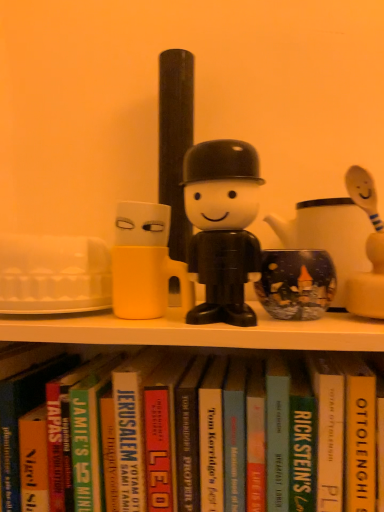
What do you see at coordinates (129, 435) in the screenshot? The image size is (384, 512). I see `hardcover book at center, the 1th paperback book positioned from the left` at bounding box center [129, 435].

Describe the element at coordinates (222, 227) in the screenshot. I see `black plastic figure at center` at that location.

In order to click on hardcover book at center, arranged as the second paperback book when viewed from the left in this screenshot , I will do `click(162, 432)`.

The width and height of the screenshot is (384, 512). Find the location of `hardcover book at center, which is counted as the fourth paperback book, starting from the right`. hardcover book at center, which is counted as the fourth paperback book, starting from the right is located at coordinates (188, 436).

Find the location of `hardcover book at center, marked as the fourth paperback book in a left-to-right arrangement`. hardcover book at center, marked as the fourth paperback book in a left-to-right arrangement is located at coordinates (277, 434).

Would you say hardcover book at center, the 1th paperback book positioned from the left, is to the left or to the right of hardcover book at center, the fifth paperback book when ordered from right to left, in the picture?

Based on their positions, hardcover book at center, the 1th paperback book positioned from the left, is located to the left of hardcover book at center, the fifth paperback book when ordered from right to left.

Considering the relative sizes of hardcover book at center, which is counted as the 6th paperback book, starting from the right, and hardcover book at center, the fifth paperback book when ordered from right to left, in the image provided, is hardcover book at center, which is counted as the 6th paperback book, starting from the right, thinner than hardcover book at center, the fifth paperback book when ordered from right to left,?

Correct, the width of hardcover book at center, which is counted as the 6th paperback book, starting from the right, is less than that of hardcover book at center, the fifth paperback book when ordered from right to left.

Which is nearer, (x=139, y=360) or (x=171, y=397)?

Point (x=139, y=360) is positioned farther from the camera compared to point (x=171, y=397).

The height and width of the screenshot is (512, 384). In order to click on toy on the left of the hardcover book at center, placed as the third paperback book when sorted from right to left in this screenshot , I will do `click(222, 227)`.

Considering the sizes of objects black plastic figure at center and hardcover book at center, placed as the third paperback book when sorted from right to left, in the image provided, who is wider, black plastic figure at center or hardcover book at center, placed as the third paperback book when sorted from right to left,?

With larger width is hardcover book at center, placed as the third paperback book when sorted from right to left.

Do you think black plastic figure at center is within hardcover book at center, marked as the fourth paperback book in a left-to-right arrangement, or outside of it?

black plastic figure at center is outside hardcover book at center, marked as the fourth paperback book in a left-to-right arrangement.

In the scene shown: Considering the relative positions of hardcover book at center, positioned as the third paperback book in left-to-right order, and black plastic figure at center in the image provided, is hardcover book at center, positioned as the third paperback book in left-to-right order, in front of black plastic figure at center?

No, hardcover book at center, positioned as the third paperback book in left-to-right order, is behind black plastic figure at center.

From the image's perspective, is hardcover book at center, positioned as the third paperback book in left-to-right order, over black plastic figure at center?

No.

Is hardcover book at center, positioned as the third paperback book in left-to-right order, shorter than black plastic figure at center?

In fact, hardcover book at center, positioned as the third paperback book in left-to-right order, may be taller than black plastic figure at center.

Is hardcover book at center, positioned as the third paperback book in left-to-right order, not near black plastic figure at center?

No.

At what (x,y) coordinates should I click in order to perform the action: click on the 4th paperback book behind the hardcover book at center, marked as the fourth paperback book in a left-to-right arrangement, counting from the anchor's position. Please return your answer as a coordinate pair (x, y). Looking at the image, I should click on (129, 435).

Looking at their sizes, would you say hardcover book at center, the 1th paperback book positioned from the left, is wider or thinner than hardcover book at center, marked as the fourth paperback book in a left-to-right arrangement?

hardcover book at center, the 1th paperback book positioned from the left, is thinner than hardcover book at center, marked as the fourth paperback book in a left-to-right arrangement.

Between hardcover book at center, the 1th paperback book positioned from the left, and hardcover book at center, placed as the third paperback book when sorted from right to left, which one appears on the left side from the viewer's perspective?

hardcover book at center, the 1th paperback book positioned from the left.

From a real-world perspective, is hardcover book at center, which is counted as the 6th paperback book, starting from the right, positioned over hardcover book at center, marked as the fourth paperback book in a left-to-right arrangement, based on gravity?

No, from a real-world perspective, hardcover book at center, which is counted as the 6th paperback book, starting from the right, is not above hardcover book at center, marked as the fourth paperback book in a left-to-right arrangement.

Is point (308, 443) closer to viewer compared to point (227, 317)?

No, (308, 443) is behind (227, 317).

Is green matte paperback book at center, marked as the fifth paperback book in a left-to-right arrangement, to the left or to the right of black plastic figure at center in the image?

In the image, green matte paperback book at center, marked as the fifth paperback book in a left-to-right arrangement, appears on the right side of black plastic figure at center.

From the image's perspective, is green matte paperback book at center, which is the 2th paperback book from right to left, located above or below black plastic figure at center?

From the image's perspective, green matte paperback book at center, which is the 2th paperback book from right to left, appears below black plastic figure at center.

Which object is further away from the camera, green matte paperback book at center, which is the 2th paperback book from right to left, or black plastic figure at center?

green matte paperback book at center, which is the 2th paperback book from right to left.

From a real-world perspective, is hardcover book at center, the fifth paperback book when ordered from right to left, located higher than green matte paperback book at center, marked as the fifth paperback book in a left-to-right arrangement?

No, from a real-world perspective, hardcover book at center, the fifth paperback book when ordered from right to left, is not above green matte paperback book at center, marked as the fifth paperback book in a left-to-right arrangement.

Looking at their sizes, would you say hardcover book at center, arranged as the second paperback book when viewed from the left, is wider or thinner than green matte paperback book at center, which is the 2th paperback book from right to left?

Clearly, hardcover book at center, arranged as the second paperback book when viewed from the left, has more width compared to green matte paperback book at center, which is the 2th paperback book from right to left.

Which object is positioned more to the right, hardcover book at center, arranged as the second paperback book when viewed from the left, or green matte paperback book at center, marked as the fifth paperback book in a left-to-right arrangement?

Positioned to the right is green matte paperback book at center, marked as the fifth paperback book in a left-to-right arrangement.

From the image's perspective, which one is positioned lower, hardcover book at center, the fifth paperback book when ordered from right to left, or green matte paperback book at center, marked as the fifth paperback book in a left-to-right arrangement?

hardcover book at center, the fifth paperback book when ordered from right to left.

The width and height of the screenshot is (384, 512). In order to click on the 2nd paperback book to the left of the hardcover book at center, marked as the fourth paperback book in a left-to-right arrangement, counting from the anchor's position in this screenshot , I will do click(x=162, y=432).

Is hardcover book at center, the fifth paperback book when ordered from right to left, completely or partially outside of hardcover book at center, marked as the fourth paperback book in a left-to-right arrangement?

Yes, hardcover book at center, the fifth paperback book when ordered from right to left, is not within hardcover book at center, marked as the fourth paperback book in a left-to-right arrangement.

Is hardcover book at center, arranged as the second paperback book when viewed from the left, positioned in front of hardcover book at center, placed as the third paperback book when sorted from right to left?

No, hardcover book at center, arranged as the second paperback book when viewed from the left, is further to the viewer.

Considering the relative sizes of hardcover book at center, arranged as the second paperback book when viewed from the left, and hardcover book at center, placed as the third paperback book when sorted from right to left, in the image provided, is hardcover book at center, arranged as the second paperback book when viewed from the left, thinner than hardcover book at center, placed as the third paperback book when sorted from right to left,?

Correct, the width of hardcover book at center, arranged as the second paperback book when viewed from the left, is less than that of hardcover book at center, placed as the third paperback book when sorted from right to left.

The image size is (384, 512). There is a hardcover book at center, arranged as the second paperback book when viewed from the left. In order to click on the 2nd paperback book below it (from the image's perspective) in this screenshot , I will do 129,435.

This screenshot has width=384, height=512. I want to click on toy above the hardcover book at center, placed as the third paperback book when sorted from right to left (from a real-world perspective), so 222,227.

When comparing their distances from yellow hardcover book at center, arranged as the 1th paperback book when viewed from the right, does hardcover book at center, the fifth paperback book when ordered from right to left, or hardcover book at center, positioned as the third paperback book in left-to-right order, seem further?

Among the two, hardcover book at center, the fifth paperback book when ordered from right to left, is located further to yellow hardcover book at center, arranged as the 1th paperback book when viewed from the right.

Considering their positions, is black plastic figure at center positioned further to hardcover book at center, placed as the third paperback book when sorted from right to left, than hardcover book at center, which is counted as the fourth paperback book, starting from the right?

black plastic figure at center is positioned further to the anchor hardcover book at center, placed as the third paperback book when sorted from right to left.

When comparing their distances from green matte paperback book at center, marked as the fifth paperback book in a left-to-right arrangement, does hardcover book at center, the 1th paperback book positioned from the left, or hardcover book at center, arranged as the second paperback book when viewed from the left, seem further?

hardcover book at center, the 1th paperback book positioned from the left.

From the image, which object appears to be nearer to hardcover book at center, which is counted as the fourth paperback book, starting from the right, yellow hardcover book at center, marked as the sixth paperback book in a left-to-right arrangement, or hardcover book at center, the fifth paperback book when ordered from right to left?

hardcover book at center, the fifth paperback book when ordered from right to left, is positioned closer to the anchor hardcover book at center, which is counted as the fourth paperback book, starting from the right.

From the image, which object appears to be farther from green matte paperback book at center, marked as the fifth paperback book in a left-to-right arrangement, hardcover book at center, which is counted as the 6th paperback book, starting from the right, or hardcover book at center, marked as the fourth paperback book in a left-to-right arrangement?

Among the two, hardcover book at center, which is counted as the 6th paperback book, starting from the right, is located further to green matte paperback book at center, marked as the fifth paperback book in a left-to-right arrangement.

Estimate the real-world distances between objects in this image. Which object is further from hardcover book at center, arranged as the second paperback book when viewed from the left, green matte paperback book at center, marked as the fifth paperback book in a left-to-right arrangement, or black plastic figure at center?

black plastic figure at center.

Estimate the real-world distances between objects in this image. Which object is further from hardcover book at center, arranged as the second paperback book when viewed from the left, hardcover book at center, marked as the fourth paperback book in a left-to-right arrangement, or hardcover book at center, positioned as the third paperback book in left-to-right order?

hardcover book at center, marked as the fourth paperback book in a left-to-right arrangement, is further to hardcover book at center, arranged as the second paperback book when viewed from the left.

Estimate the real-world distances between objects in this image. Which object is closer to black plastic figure at center, hardcover book at center, arranged as the second paperback book when viewed from the left, or hardcover book at center, the 1th paperback book positioned from the left?

hardcover book at center, arranged as the second paperback book when viewed from the left, is closer to black plastic figure at center.

This screenshot has height=512, width=384. I want to click on paperback book between hardcover book at center, the 1th paperback book positioned from the left, and hardcover book at center, positioned as the third paperback book in left-to-right order, so click(x=162, y=432).

You are a GUI agent. You are given a task and a screenshot of the screen. Output one action in this format:
    pyautogui.click(x=<x>, y=<y>)
    Task: Click on the paperback book situated between hardcover book at center, marked as the fourth paperback book in a left-to-right arrangement, and yellow hardcover book at center, marked as the sixth paperback book in a left-to-right arrangement, from left to right
    This screenshot has width=384, height=512.
    Given the screenshot: What is the action you would take?
    [301, 440]

This screenshot has width=384, height=512. Find the location of `paperback book located between hardcover book at center, which is counted as the fourth paperback book, starting from the right, and green matte paperback book at center, which is the 2th paperback book from right to left, in the left-right direction`. paperback book located between hardcover book at center, which is counted as the fourth paperback book, starting from the right, and green matte paperback book at center, which is the 2th paperback book from right to left, in the left-right direction is located at coordinates (277, 434).

I want to click on paperback book between hardcover book at center, the fifth paperback book when ordered from right to left, and hardcover book at center, marked as the fourth paperback book in a left-to-right arrangement, so click(x=188, y=436).